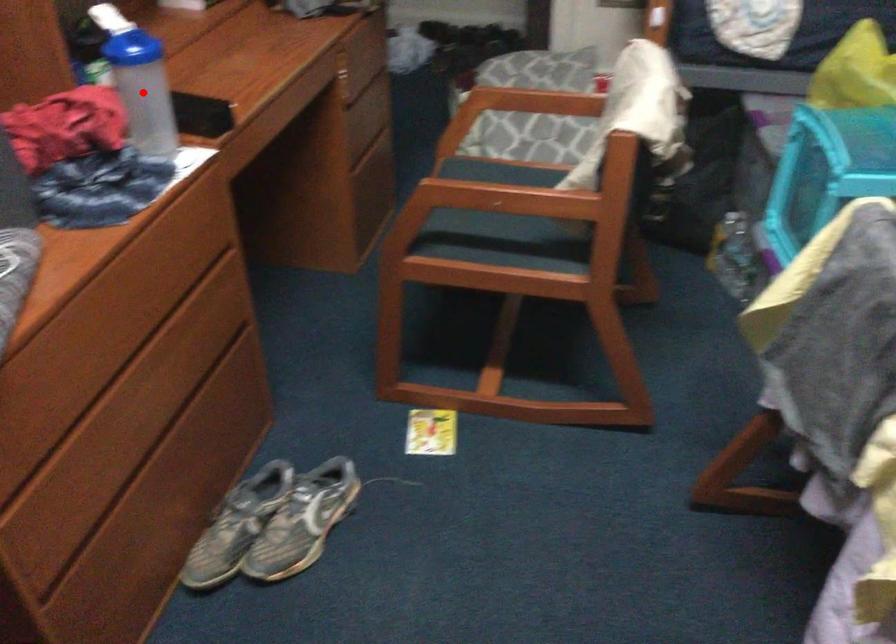
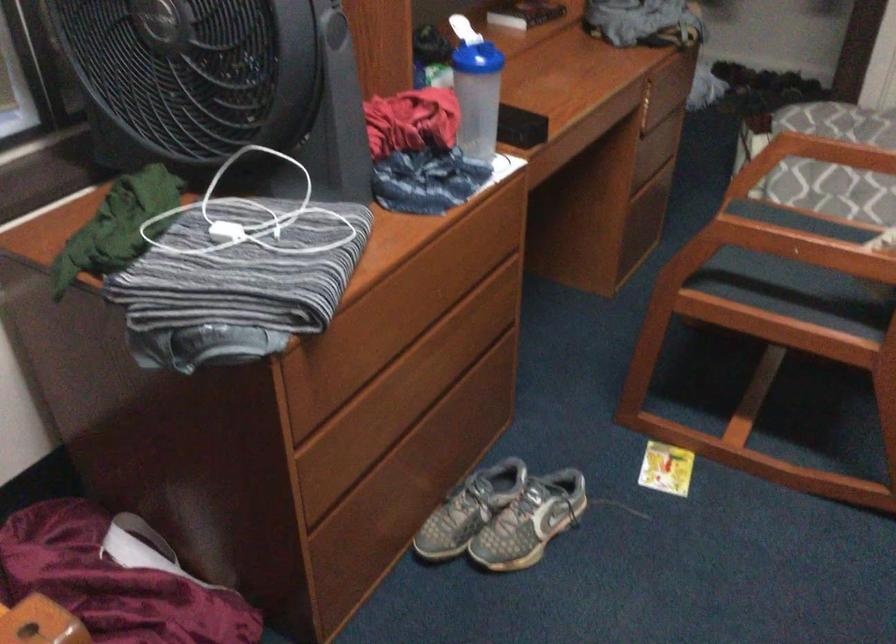
The point at the highlighted location is marked in the first image. Where is the corresponding point in the second image?

(478, 97)